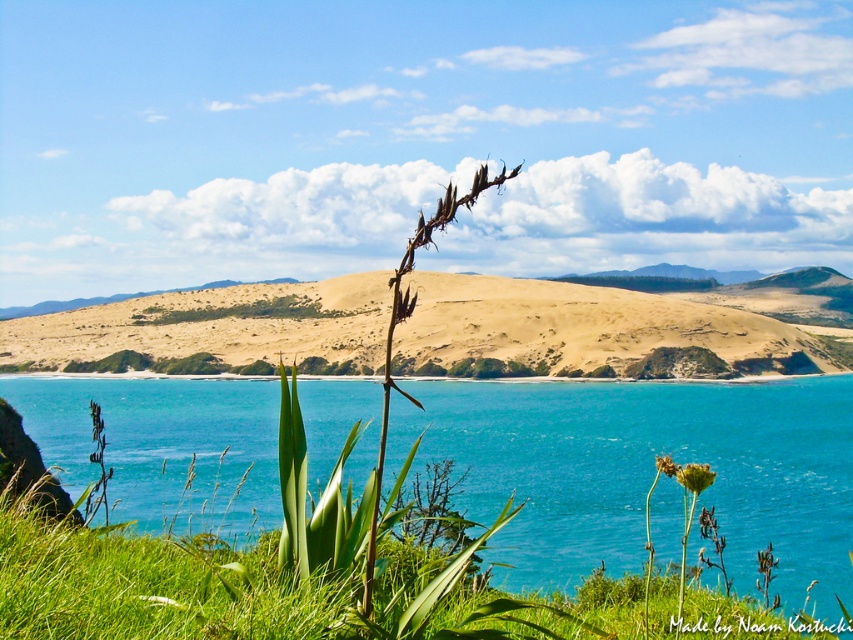
Question: Which is nearer to the turquoise water at center?

Choices:
 (A) yellow-green textured flower at center-right
 (B) sandy/dry hillside at center
 (C) yellow matte flower at center

Answer: (A)

Question: Does sandy/dry hillside at center come behind yellow matte flower at center?

Choices:
 (A) yes
 (B) no

Answer: (B)

Question: From the image, what is the correct spatial relationship of turquoise water at center in relation to yellow matte flower at center?

Choices:
 (A) right
 (B) left

Answer: (A)

Question: Which of the following is the farthest from the observer?

Choices:
 (A) turquoise water at center
 (B) yellow-green textured flower at center-right
 (C) yellow matte flower at center

Answer: (A)

Question: Is sandy/dry hillside at center below yellow matte flower at center?

Choices:
 (A) no
 (B) yes

Answer: (A)

Question: Which point is farther from the camera taking this photo?

Choices:
 (A) (218, 296)
 (B) (650, 429)
 (C) (657, 458)

Answer: (A)